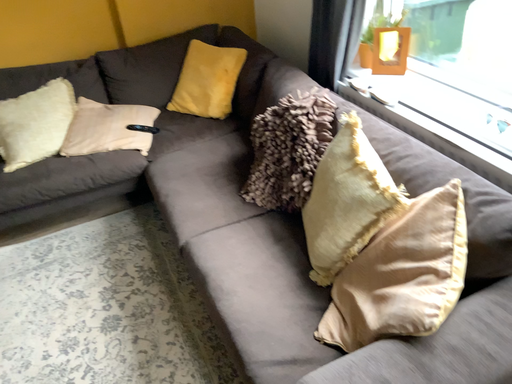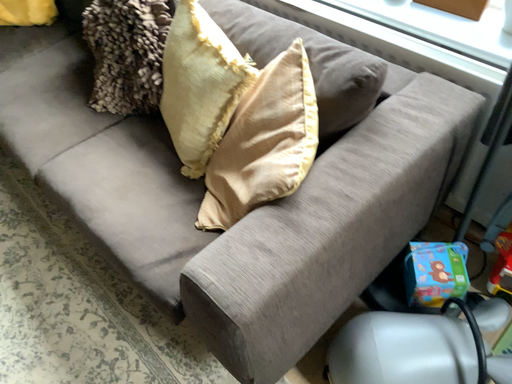
Question: Which way did the camera rotate in the video?

Choices:
 (A) rotated downward
 (B) rotated upward

Answer: (A)